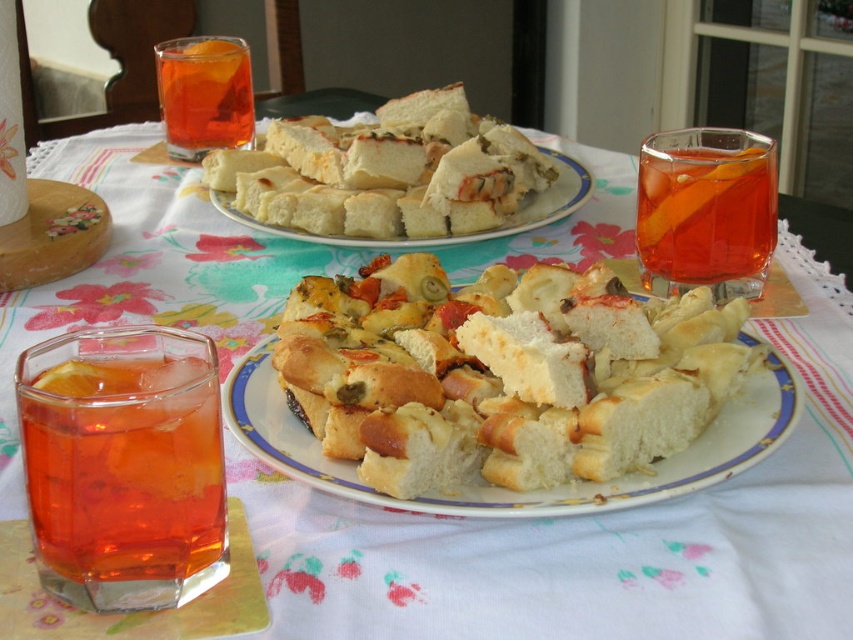
Question: Is translucent glass at right wider than translucent glass drink at upper center?

Choices:
 (A) yes
 (B) no

Answer: (B)

Question: Which of the following is the closest to the observer?

Choices:
 (A) translucent glass drink at lower left
 (B) white bread at center
 (C) translucent glass at right

Answer: (A)

Question: Observing the image, what is the correct spatial positioning of translucent glass drink at lower left in reference to translucent glass drink at upper center?

Choices:
 (A) left
 (B) right

Answer: (B)

Question: Among these objects, which one is nearest to the camera?

Choices:
 (A) translucent glass at right
 (B) translucent glass drink at upper center
 (C) translucent glass drink at lower left
 (D) golden crusty bread at center

Answer: (C)

Question: Which of these objects is positioned closest to the translucent glass at right?

Choices:
 (A) translucent glass drink at lower left
 (B) white bread at center
 (C) translucent glass drink at upper center
 (D) golden crusty bread at center

Answer: (B)

Question: Considering the relative positions of translucent glass at right and translucent glass drink at upper center in the image provided, where is translucent glass at right located with respect to translucent glass drink at upper center?

Choices:
 (A) below
 (B) above

Answer: (A)